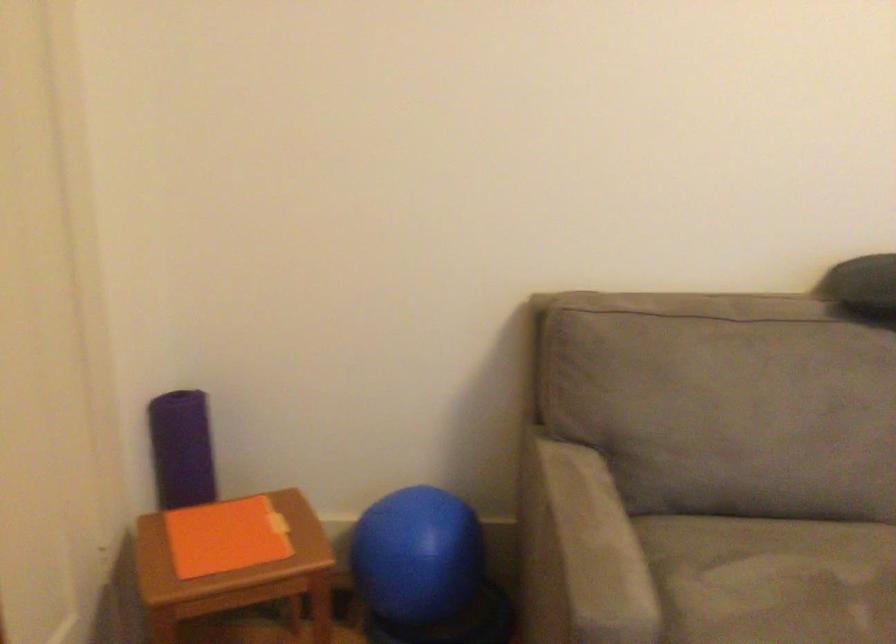
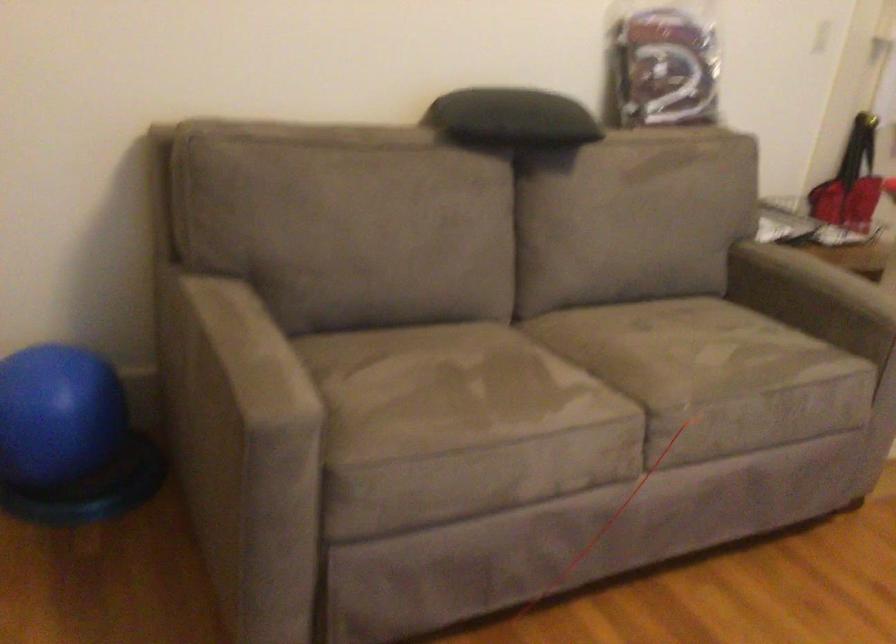
Question: The images are taken continuously from a first-person perspective. In which direction is your viewpoint rotating?

Choices:
 (A) Left
 (B) Right
 (C) Up
 (D) Down

Answer: (B)